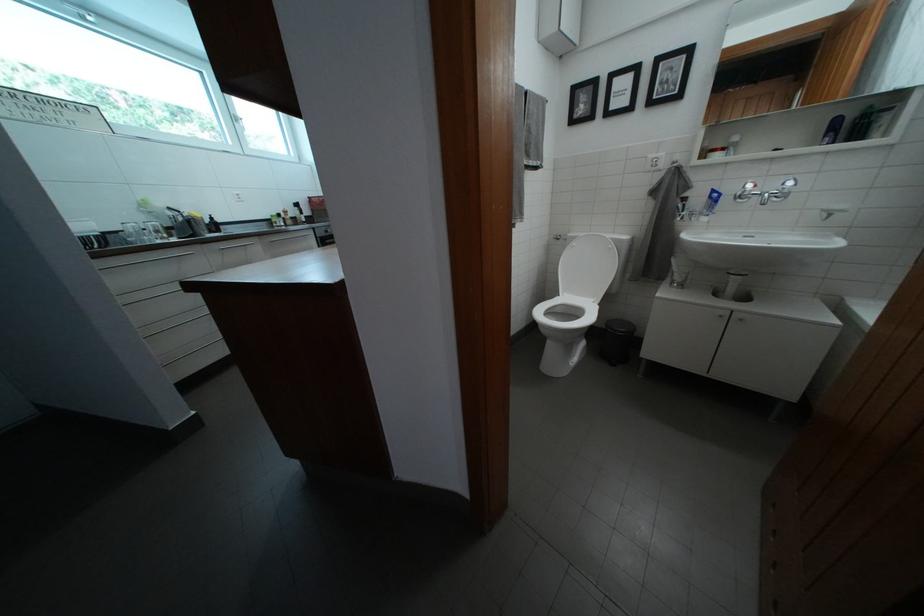
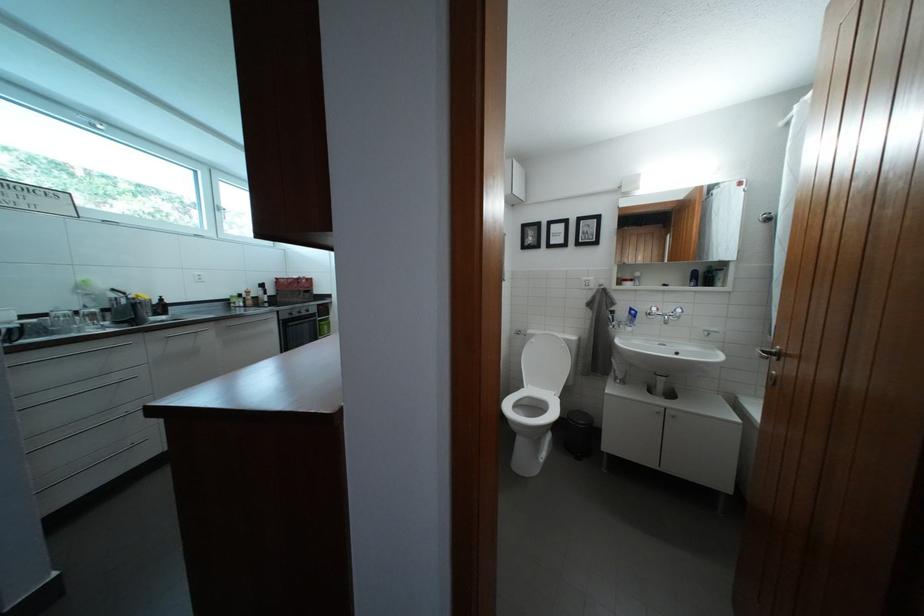
Where in the second image is the point corresponding to (216,225) from the first image?

(165, 307)